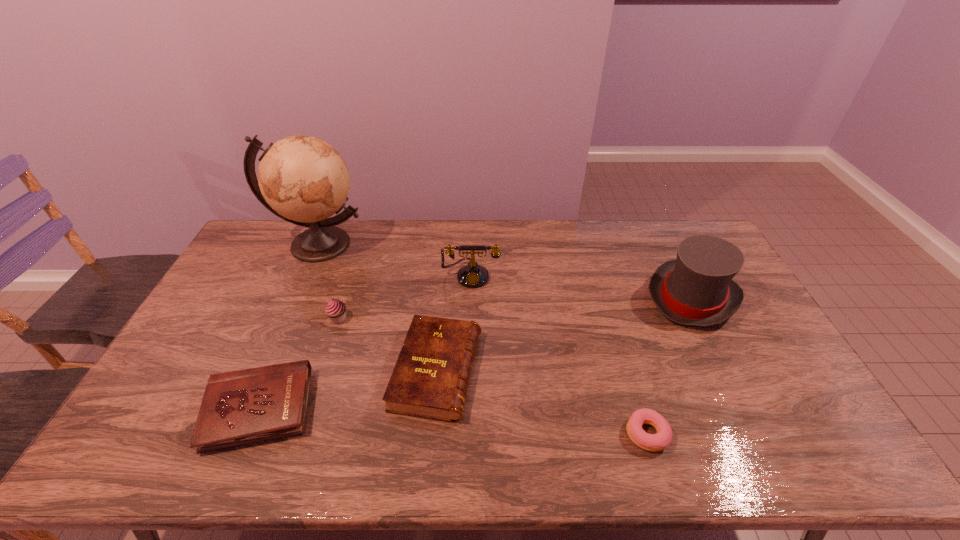
Find the location of a particular element. vacant point located between the fourth shortest object and the shortest object is located at coordinates (492, 376).

At what (x,y) coordinates should I click in order to perform the action: click on vacant region between the globe and the left hardback book. Please return your answer as a coordinate pair (x, y). Image resolution: width=960 pixels, height=540 pixels. Looking at the image, I should click on (289, 327).

At what (x,y) coordinates should I click in order to perform the action: click on free spot between the dress hat and the globe. Please return your answer as a coordinate pair (x, y). The width and height of the screenshot is (960, 540). Looking at the image, I should click on (506, 271).

Find the location of a particular element. The image size is (960, 540). vacant space that's between the dress hat and the second object from right to left is located at coordinates (670, 365).

At what (x,y) coordinates should I click in order to perform the action: click on vacant region between the right hardback book and the tallest object. Please return your answer as a coordinate pair (x, y). This screenshot has width=960, height=540. Looking at the image, I should click on (378, 308).

I want to click on vacant point located between the tallest object and the shortest object, so click(x=483, y=339).

The height and width of the screenshot is (540, 960). Identify the location of object that is the sixth nearest to the fourth shortest object. (696, 289).

Identify the location of the closest object to the telephone. The width and height of the screenshot is (960, 540). (430, 379).

Where is `vacant area that satisfies the following two spatial constraints: 1. on the front-facing side of the left hardback book; 2. on the left side of the globe`? This screenshot has width=960, height=540. vacant area that satisfies the following two spatial constraints: 1. on the front-facing side of the left hardback book; 2. on the left side of the globe is located at coordinates (246, 410).

Locate an element on the screen. free spot that satisfies the following two spatial constraints: 1. on the front side of the doughnut; 2. on the left side of the fourth shortest object is located at coordinates (300, 434).